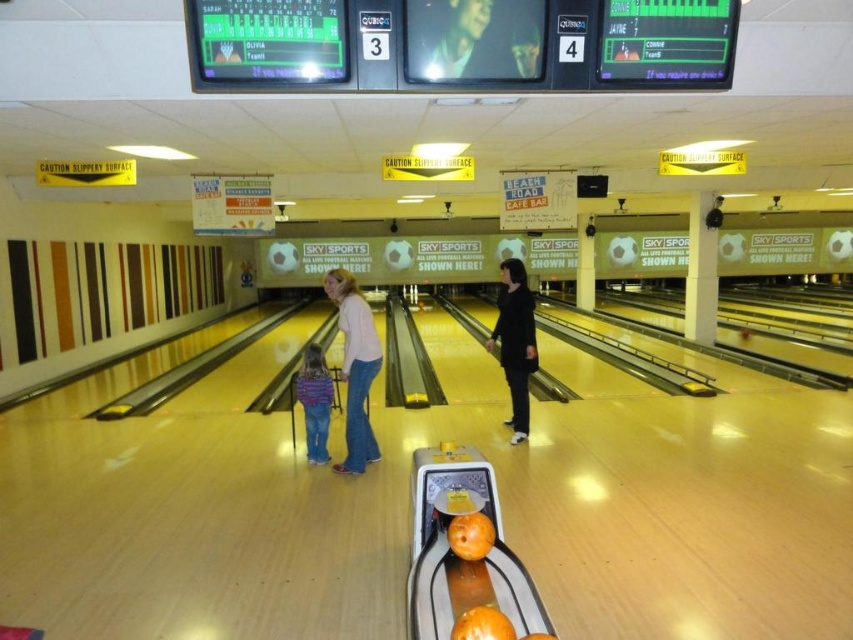
You are a photographer taking a picture of the smooth skin face at upper center and the striped fabric shirt at center. Which object should you focus on first if you want to capture both in the same frame?

The smooth skin face at upper center is positioned on the right side of striped fabric shirt at center, so you should focus on the striped fabric shirt at center first to ensure both are in the frame.

In the scene shown: You are a photographer positioned at the end of the bowling lanes. You need to capture a photo of both the matte pink sweater at center and the black matte jacket at center. Since you can only focus on one object at a time, which object should you focus on first to ensure both are in the frame?

The matte pink sweater at center occupies less space than the black matte jacket at center, so you should focus on the black matte jacket at center first to ensure both are in the frame.

You are standing at the entrance of the bowling alley and see the black matte jacket at center represented by point (515, 342). If you walk straight ahead, will you pass by the ball return machine with orange bowling balls first or reach the people at the center lane first?

The black matte jacket at center is represented by point (515, 342), so walking straight ahead from the entrance, you would reach the people at the center lane first before passing the ball return machine with orange bowling balls.